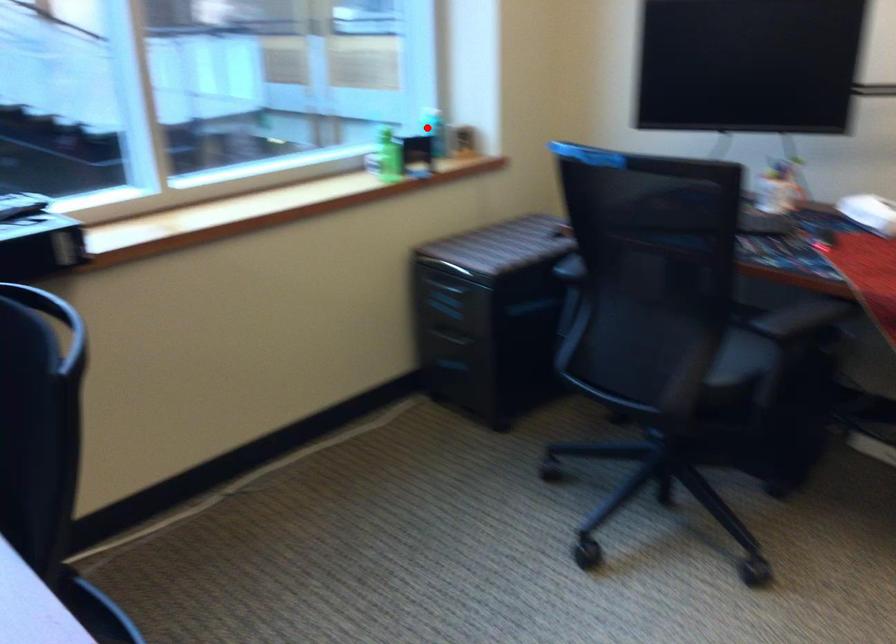
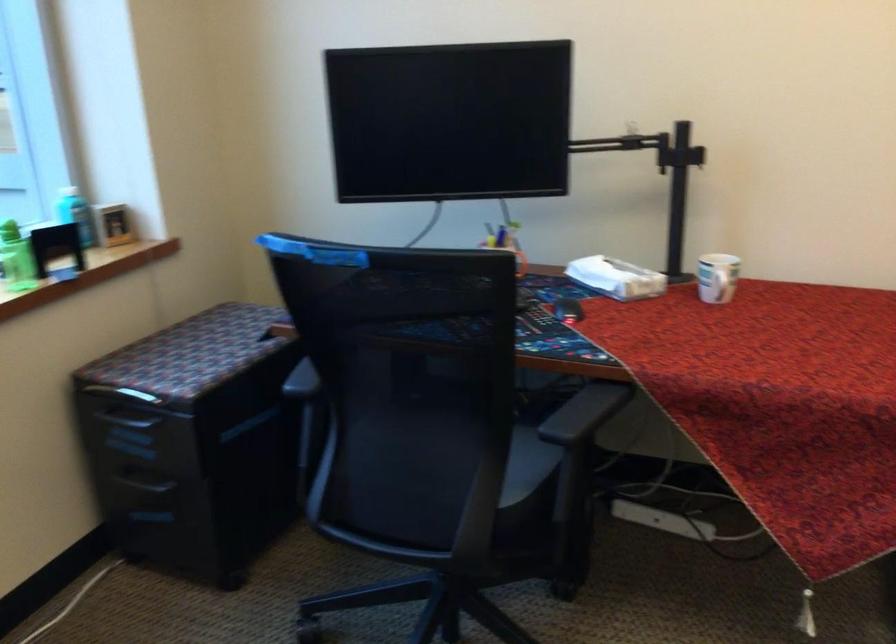
Question: I am providing you with two images of the same scene from different viewpoints. In image1, a red point is highlighted. Considering the same 3D point in image2, which of the following is correct?

Choices:
 (A) It is closer
 (B) It is farther

Answer: (A)